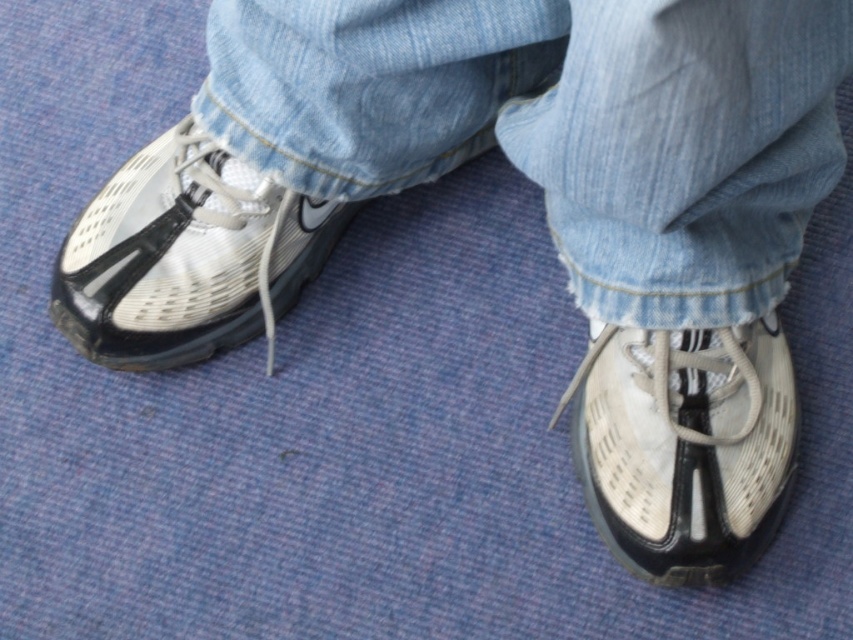
Question: Does denim at lower left lie in front of white mesh shoe at lower right?

Choices:
 (A) no
 (B) yes

Answer: (B)

Question: Which of the following is the closest to the observer?

Choices:
 (A) shiny silver shoe at left
 (B) white mesh shoe at lower right

Answer: (B)

Question: Which point appears closest to the camera in this image?

Choices:
 (A) (611, 129)
 (B) (287, 298)

Answer: (A)

Question: Can you confirm if white mesh shoe at lower right is positioned to the right of shiny silver shoe at left?

Choices:
 (A) yes
 (B) no

Answer: (A)

Question: Can you confirm if denim at lower left is thinner than white mesh shoe at lower right?

Choices:
 (A) yes
 (B) no

Answer: (B)

Question: Which object is closer to the camera taking this photo?

Choices:
 (A) white mesh shoe at lower right
 (B) shiny silver shoe at left
 (C) denim at lower left

Answer: (C)